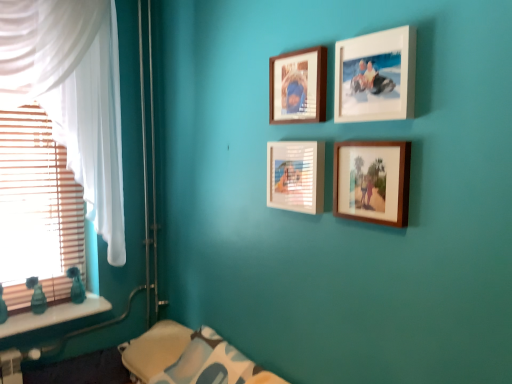
Measure the distance between white marble window sill at lower left and camera.

white marble window sill at lower left and camera are 6.33 feet apart.

How much space does wooden photo frame at center-right, acting as the fourth picture frame starting from the top, occupy horizontally?

wooden photo frame at center-right, acting as the fourth picture frame starting from the top, is 1.26 inches in width.

What do you see at coordinates (72, 94) in the screenshot?
I see `white sheer curtain at left` at bounding box center [72, 94].

This screenshot has width=512, height=384. Find the location of `white marble window sill at lower left`. white marble window sill at lower left is located at coordinates (54, 315).

Is white glossy picture frame at center, acting as the 3th picture frame starting from the top, directly adjacent to soft white fabric pillow at lower center?

They are not placed beside each other.

Is white glossy picture frame at center, arranged as the second picture frame when ordered from the bottom, facing away from soft white fabric pillow at lower center?

No, white glossy picture frame at center, arranged as the second picture frame when ordered from the bottom, is not facing away from soft white fabric pillow at lower center.

Does white glossy picture frame at center, acting as the 3th picture frame starting from the top, have a larger size compared to soft white fabric pillow at lower center?

Incorrect, white glossy picture frame at center, acting as the 3th picture frame starting from the top, is not larger than soft white fabric pillow at lower center.

Does wooden photo frame at center-right, which is the first picture frame from bottom to top, have a lesser height compared to wooden blinds at left?

Yes, wooden photo frame at center-right, which is the first picture frame from bottom to top, is shorter than wooden blinds at left.

Consider the image. Which is less distant, (385, 202) or (24, 144)?

→ Point (385, 202)

Which of these two, wooden photo frame at center-right, which is the first picture frame from bottom to top, or wooden blinds at left, is bigger?

wooden blinds at left is bigger.

Could you tell me if wooden photo frame at center-right, acting as the fourth picture frame starting from the top, is facing wooden blinds at left?

No, wooden photo frame at center-right, acting as the fourth picture frame starting from the top, is not facing towards wooden blinds at left.

Is wooden blinds at left far from white marble window sill at lower left?

No.

Considering the sizes of wooden blinds at left and white marble window sill at lower left in the image, is wooden blinds at left bigger or smaller than white marble window sill at lower left?

In the image, wooden blinds at left appears to be larger than white marble window sill at lower left.

From the image's perspective, relative to white marble window sill at lower left, is wooden blinds at left above or below?

From the image's perspective, wooden blinds at left appears above white marble window sill at lower left.

Is the depth of wooden blinds at left greater than that of white marble window sill at lower left?

Yes.

Looking at this image, is wooden blinds at left outside of white glossy picture frame at center, acting as the 3th picture frame starting from the top?

Yes, wooden blinds at left is not within white glossy picture frame at center, acting as the 3th picture frame starting from the top.

Is white glossy picture frame at center, acting as the 3th picture frame starting from the top, at the back of wooden blinds at left?

No, wooden blinds at left is not facing away from white glossy picture frame at center, acting as the 3th picture frame starting from the top.

From the image's perspective, relative to white glossy picture frame at center, acting as the 3th picture frame starting from the top, is wooden blinds at left above or below?

wooden blinds at left is situated lower than white glossy picture frame at center, acting as the 3th picture frame starting from the top, in the image.

In order to click on window blind below the white glossy picture frame at center, acting as the 3th picture frame starting from the top (from the image's perspective) in this screenshot , I will do `click(37, 210)`.

Based on the photo, is white sheer curtain at left not close to wooden blinds at left?

white sheer curtain at left is actually quite close to wooden blinds at left.

Which object is positioned more to the right, white sheer curtain at left or wooden blinds at left?

From the viewer's perspective, white sheer curtain at left appears more on the right side.

In terms of height, does white sheer curtain at left look taller or shorter compared to wooden blinds at left?

white sheer curtain at left is taller than wooden blinds at left.

Considering the relative sizes of white sheer curtain at left and wooden blinds at left in the image provided, is white sheer curtain at left smaller than wooden blinds at left?

No, white sheer curtain at left is not smaller than wooden blinds at left.

Is wooden photo frame at center-right, which is the first picture frame from bottom to top, at the back of white matte picture frame at upper center, the third picture frame ordered from the bottom?

No, white matte picture frame at upper center, the third picture frame ordered from the bottom, is not facing away from wooden photo frame at center-right, which is the first picture frame from bottom to top.

Consider the image. Considering the relative sizes of white matte picture frame at upper center, the third picture frame ordered from the bottom, and wooden photo frame at center-right, which is the first picture frame from bottom to top, in the image provided, is white matte picture frame at upper center, the third picture frame ordered from the bottom, taller than wooden photo frame at center-right, which is the first picture frame from bottom to top,?

Yes, white matte picture frame at upper center, the third picture frame ordered from the bottom, is taller than wooden photo frame at center-right, which is the first picture frame from bottom to top.

Does white matte picture frame at upper center, the third picture frame ordered from the bottom, appear on the left side of wooden photo frame at center-right, acting as the fourth picture frame starting from the top?

Yes, white matte picture frame at upper center, the third picture frame ordered from the bottom, is to the left of wooden photo frame at center-right, acting as the fourth picture frame starting from the top.

Between white matte picture frame at upper center, marked as the second picture frame in a top-to-bottom arrangement, and wooden photo frame at center-right, which is the first picture frame from bottom to top, which one has larger width?

Wider between the two is white matte picture frame at upper center, marked as the second picture frame in a top-to-bottom arrangement.

From their relative heights in the image, would you say white sheer curtain at left is taller or shorter than wooden photo frame at center-right, acting as the fourth picture frame starting from the top?

white sheer curtain at left is taller than wooden photo frame at center-right, acting as the fourth picture frame starting from the top.

Between white sheer curtain at left and wooden photo frame at center-right, which is the first picture frame from bottom to top, which one has smaller width?

Thinner between the two is wooden photo frame at center-right, which is the first picture frame from bottom to top.

Is wooden photo frame at center-right, which is the first picture frame from bottom to top, a part of white sheer curtain at left?

Definitely not — wooden photo frame at center-right, which is the first picture frame from bottom to top, is not inside white sheer curtain at left.

Where is `pillow below the white glossy picture frame at center, arranged as the second picture frame when ordered from the bottom (from a real-world perspective)`? Image resolution: width=512 pixels, height=384 pixels. pillow below the white glossy picture frame at center, arranged as the second picture frame when ordered from the bottom (from a real-world perspective) is located at coordinates (208, 362).

From the wooden blinds at left, count 4th picture frame to the right and point to it. Please provide its 2D coordinates.

[(372, 181)]

From the image, which object appears to be farther from wooden frame at upper center, the fourth picture frame from the bottom, white glossy picture frame at center, arranged as the second picture frame when ordered from the bottom, or white matte picture frame at upper center, marked as the second picture frame in a top-to-bottom arrangement?

white glossy picture frame at center, arranged as the second picture frame when ordered from the bottom, lies further to wooden frame at upper center, the fourth picture frame from the bottom, than the other object.

Estimate the real-world distances between objects in this image. Which object is closer to white glossy picture frame at center, arranged as the second picture frame when ordered from the bottom, soft white fabric pillow at lower center or wooden photo frame at center-right, which is the first picture frame from bottom to top?

Among the two, wooden photo frame at center-right, which is the first picture frame from bottom to top, is located nearer to white glossy picture frame at center, arranged as the second picture frame when ordered from the bottom.

From the image, which object appears to be nearer to white marble window sill at lower left, wooden frame at upper center, which ranks as the 1th picture frame in top-to-bottom order, or wooden photo frame at center-right, acting as the fourth picture frame starting from the top?

Result: wooden frame at upper center, which ranks as the 1th picture frame in top-to-bottom order.

Based on the photo, based on their spatial positions, is white glossy picture frame at center, arranged as the second picture frame when ordered from the bottom, or wooden photo frame at center-right, which is the first picture frame from bottom to top, further from wooden frame at upper center, which ranks as the 1th picture frame in top-to-bottom order?

wooden photo frame at center-right, which is the first picture frame from bottom to top, lies further to wooden frame at upper center, which ranks as the 1th picture frame in top-to-bottom order, than the other object.

From the image, which object appears to be farther from white glossy picture frame at center, acting as the 3th picture frame starting from the top, wooden frame at upper center, the fourth picture frame from the bottom, or soft white fabric pillow at lower center?

soft white fabric pillow at lower center is positioned further to the anchor white glossy picture frame at center, acting as the 3th picture frame starting from the top.

Looking at the image, which one is located further to wooden photo frame at center-right, acting as the fourth picture frame starting from the top, wooden frame at upper center, the fourth picture frame from the bottom, or soft white fabric pillow at lower center?

soft white fabric pillow at lower center lies further to wooden photo frame at center-right, acting as the fourth picture frame starting from the top, than the other object.

Looking at the image, which one is located further to wooden photo frame at center-right, which is the first picture frame from bottom to top, soft white fabric pillow at lower center or white glossy picture frame at center, arranged as the second picture frame when ordered from the bottom?

soft white fabric pillow at lower center lies further to wooden photo frame at center-right, which is the first picture frame from bottom to top, than the other object.

From the image, which object appears to be farther from wooden blinds at left, white marble window sill at lower left or wooden photo frame at center-right, acting as the fourth picture frame starting from the top?

wooden photo frame at center-right, acting as the fourth picture frame starting from the top, is positioned further to the anchor wooden blinds at left.

At what (x,y) coordinates should I click in order to perform the action: click on picture frame that lies between wooden frame at upper center, the fourth picture frame from the bottom, and white glossy picture frame at center, acting as the 3th picture frame starting from the top, from top to bottom. Please return your answer as a coordinate pair (x, y). Looking at the image, I should click on (375, 76).

Identify the location of curtain located between white marble window sill at lower left and white matte picture frame at upper center, the third picture frame ordered from the bottom, in the left-right direction. (72, 94).

Locate an element on the screen. The width and height of the screenshot is (512, 384). pillow situated between wooden blinds at left and white glossy picture frame at center, acting as the 3th picture frame starting from the top, from left to right is located at coordinates (208, 362).

At what (x,y) coordinates should I click in order to perform the action: click on pillow located between wooden blinds at left and wooden frame at upper center, which ranks as the 1th picture frame in top-to-bottom order, in the left-right direction. Please return your answer as a coordinate pair (x, y). Image resolution: width=512 pixels, height=384 pixels. Looking at the image, I should click on (208, 362).